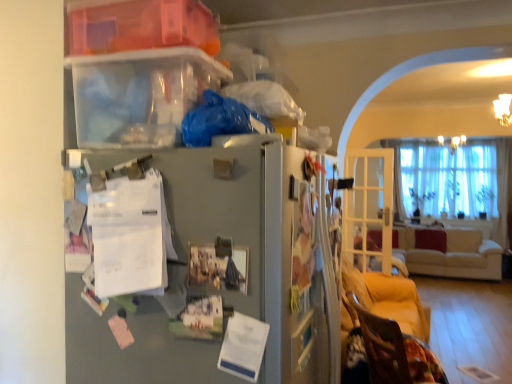
Question: Is beige fabric couch at right bigger than metallic gray fridge at center?

Choices:
 (A) no
 (B) yes

Answer: (B)

Question: Is beige fabric couch at right next to metallic gray fridge at center and touching it?

Choices:
 (A) no
 (B) yes

Answer: (A)

Question: Is beige fabric couch at right far from metallic gray fridge at center?

Choices:
 (A) no
 (B) yes

Answer: (B)

Question: From the image's perspective, is beige fabric couch at right under metallic gray fridge at center?

Choices:
 (A) no
 (B) yes

Answer: (B)

Question: Does beige fabric couch at right come in front of metallic gray fridge at center?

Choices:
 (A) no
 (B) yes

Answer: (A)

Question: Considering the relative sizes of beige fabric couch at right and metallic gray fridge at center in the image provided, is beige fabric couch at right thinner than metallic gray fridge at center?

Choices:
 (A) yes
 (B) no

Answer: (B)

Question: Does metallic gray fridge at center appear on the right side of translucent plastic storage box at upper left?

Choices:
 (A) no
 (B) yes

Answer: (B)

Question: Does metallic gray fridge at center come behind translucent plastic storage box at upper left?

Choices:
 (A) no
 (B) yes

Answer: (A)

Question: Does metallic gray fridge at center come in front of translucent plastic storage box at upper left?

Choices:
 (A) yes
 (B) no

Answer: (A)

Question: Considering the relative sizes of metallic gray fridge at center and translucent plastic storage box at upper left in the image provided, is metallic gray fridge at center thinner than translucent plastic storage box at upper left?

Choices:
 (A) yes
 (B) no

Answer: (B)

Question: Is metallic gray fridge at center facing away from translucent plastic storage box at upper left?

Choices:
 (A) no
 (B) yes

Answer: (A)

Question: Does metallic gray fridge at center have a larger size compared to translucent plastic storage box at upper left?

Choices:
 (A) no
 (B) yes

Answer: (B)

Question: Is clear glass door at right at the back of beige fabric couch at right?

Choices:
 (A) no
 (B) yes

Answer: (A)